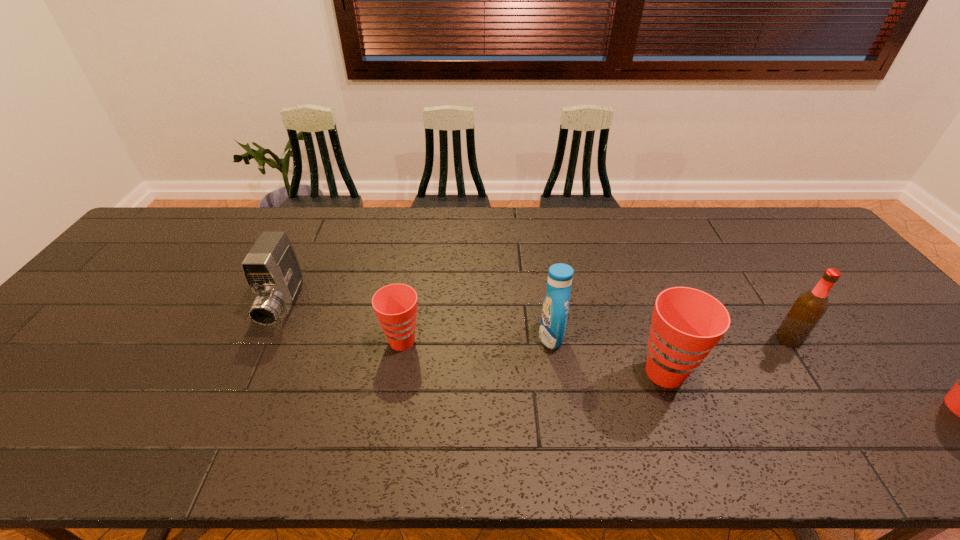
Where is `free space for a new cup on the left`? The image size is (960, 540). free space for a new cup on the left is located at coordinates (171, 313).